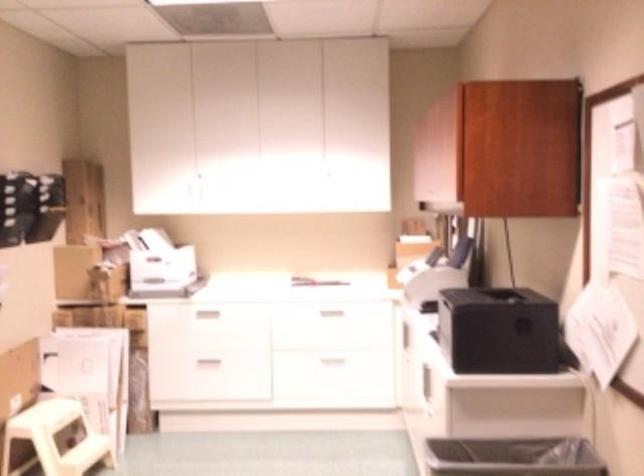
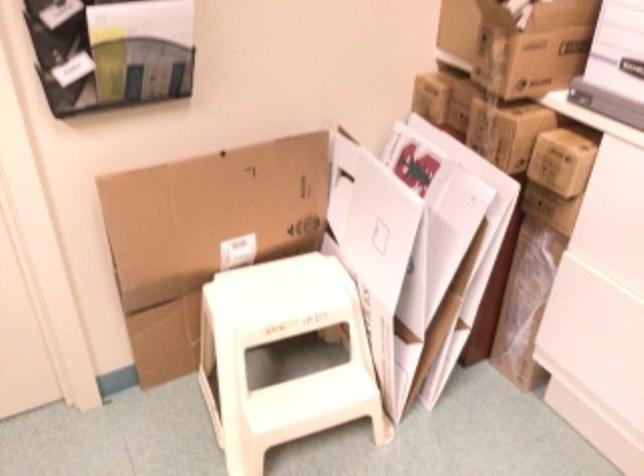
Find the pixel in the second image that matches pixel 138 317 in the first image.

(562, 160)